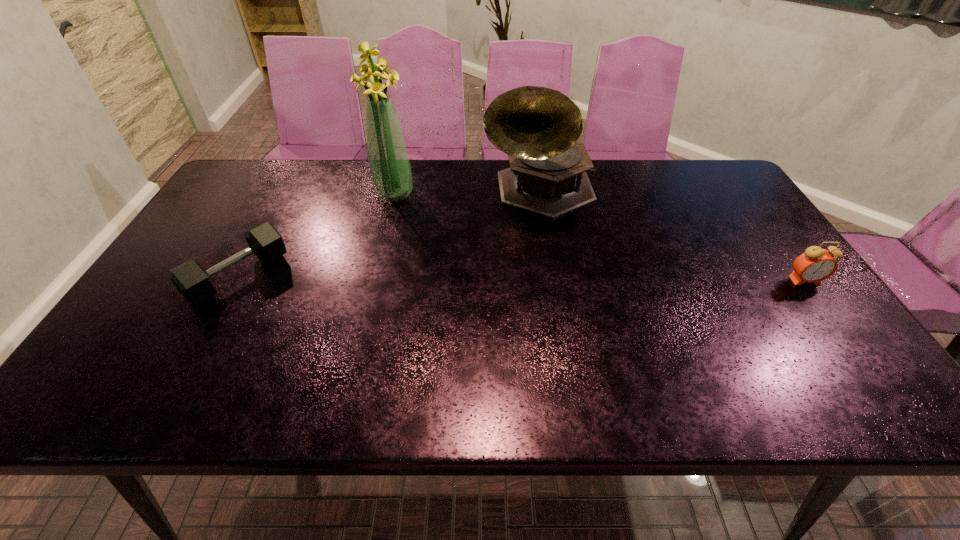
Where is `empty space between the alarm clock and the third shortest object`? Image resolution: width=960 pixels, height=540 pixels. empty space between the alarm clock and the third shortest object is located at coordinates (672, 236).

Find the location of a particular element. The image size is (960, 540). vacant region between the bouquet and the dumbbell is located at coordinates (316, 235).

At what (x,y) coordinates should I click in order to perform the action: click on free spot between the rightmost object and the dumbbell. Please return your answer as a coordinate pair (x, y). This screenshot has height=540, width=960. Looking at the image, I should click on 522,279.

Locate an element on the screen. empty space between the bouquet and the phonograph record is located at coordinates (466, 192).

Identify the location of vacant space that is in between the tallest object and the dumbbell. (316, 235).

Select which object appears as the closest to the dumbbell. Please provide its 2D coordinates. Your answer should be formatted as a tuple, i.e. [(x, y)], where the tuple contains the x and y coordinates of a point satisfying the conditions above.

[(389, 167)]

Image resolution: width=960 pixels, height=540 pixels. In order to click on the third closest object to the alarm clock in this screenshot , I will do `click(195, 284)`.

I want to click on free space that satisfies the following two spatial constraints: 1. on the back side of the dumbbell; 2. on the right side of the phonograph record, so click(x=286, y=191).

Image resolution: width=960 pixels, height=540 pixels. I want to click on vacant area that satisfies the following two spatial constraints: 1. on the back side of the second tallest object; 2. on the right side of the bouquet, so click(x=395, y=191).